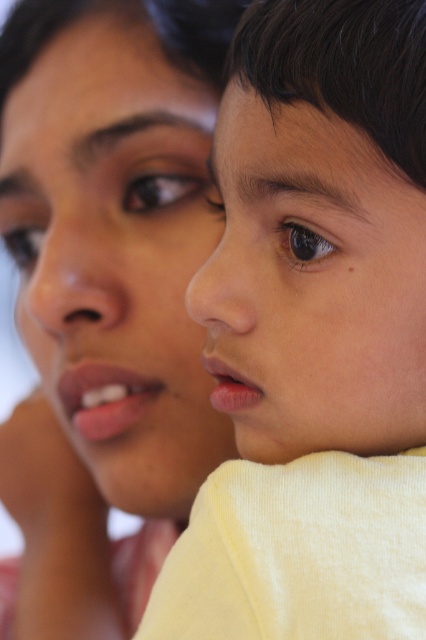
Question: Which point is farther to the camera?

Choices:
 (A) (236, 125)
 (B) (189, 148)

Answer: (B)

Question: Does smooth skin face at upper left have a greater width compared to smooth skin face at center?

Choices:
 (A) no
 (B) yes

Answer: (B)

Question: From the image, what is the correct spatial relationship of smooth skin face at upper left in relation to smooth skin face at center?

Choices:
 (A) left
 (B) right

Answer: (A)

Question: Based on their relative distances, which object is nearer to the smooth skin face at center?

Choices:
 (A) smooth skin face at upper left
 (B) smooth cream sweater at right

Answer: (B)

Question: Can you confirm if smooth cream sweater at right is thinner than smooth skin face at upper left?

Choices:
 (A) no
 (B) yes

Answer: (B)

Question: Based on their relative distances, which object is farther from the smooth skin face at center?

Choices:
 (A) smooth skin face at upper left
 (B) smooth cream sweater at right

Answer: (A)